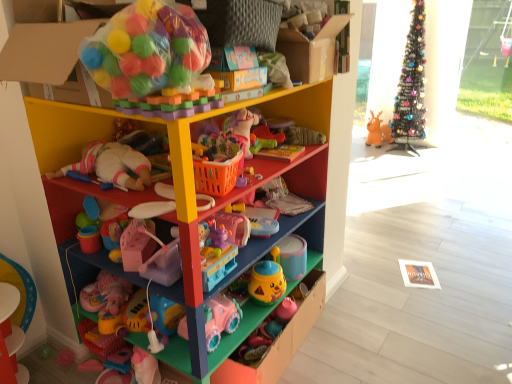
The height and width of the screenshot is (384, 512). In order to click on vacant region to the right of multicolored plastic shelf at center in this screenshot , I will do `click(374, 337)`.